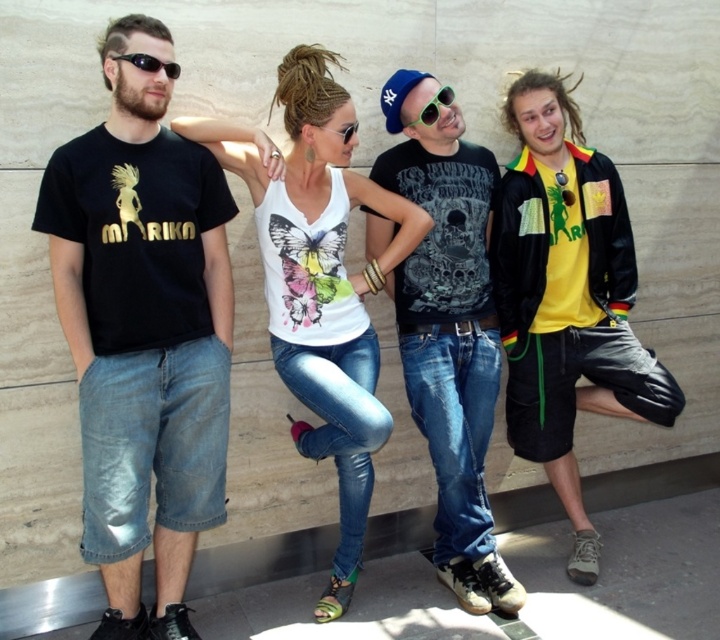
Can you confirm if black cotton t-shirt at left is positioned below yellow matte shirt at center?

Correct, black cotton t-shirt at left is located below yellow matte shirt at center.

Between point (168, 84) and point (598, 385), which one is positioned behind?

The point (598, 385) is more distant.

Identify the location of black cotton t-shirt at left. (144, 332).

Can you confirm if white matte tank top at center is thinner than clear plastic goggles at center?

In fact, white matte tank top at center might be wider than clear plastic goggles at center.

Between point (356, 486) and point (325, 124), which one is positioned behind?

The point (356, 486) is behind.

Does point (382, 406) come behind point (343, 138)?

No, (382, 406) is in front of (343, 138).

The image size is (720, 640). What are the coordinates of `white matte tank top at center` in the screenshot? It's located at (320, 284).

Identify the location of sunglasses at center. The width and height of the screenshot is (720, 640). (433, 106).

Measure the distance between sunglasses at center and clear plastic goggles at center.

The distance of sunglasses at center from clear plastic goggles at center is 14.26 inches.

Is point (415, 120) positioned behind point (351, 129)?

Yes, it is behind point (351, 129).

Identify the location of sunglasses at center. (433, 106).